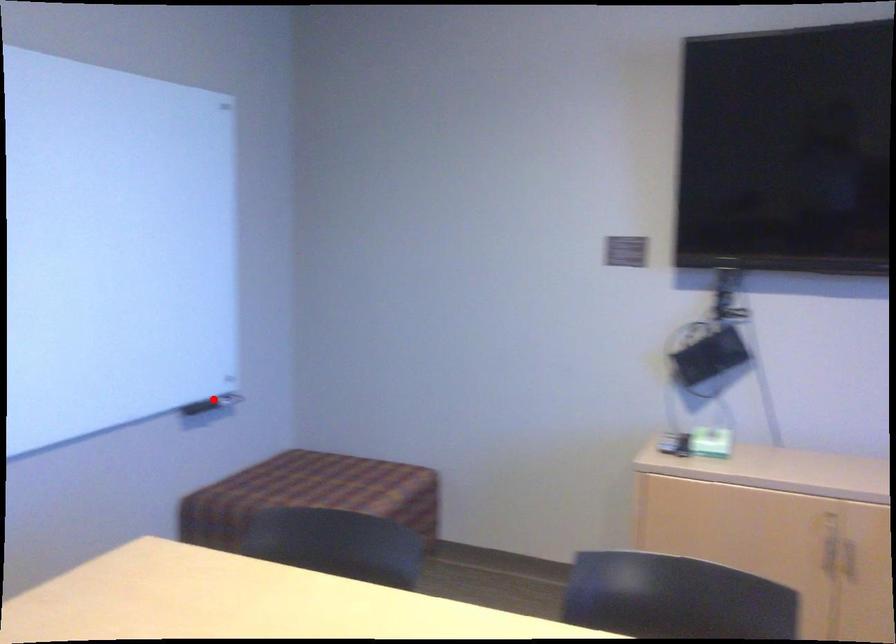
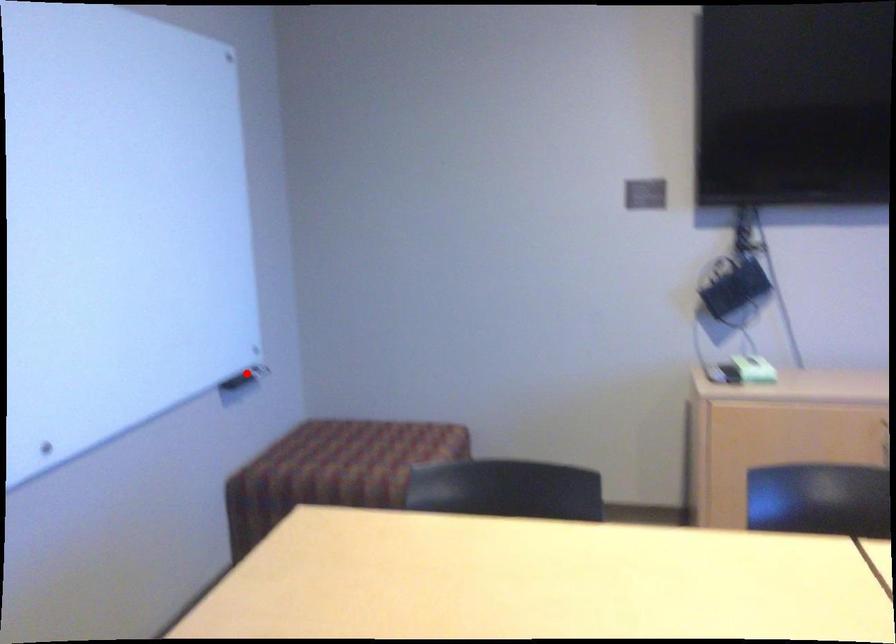
I am providing you with two images of the same scene from different viewpoints. A red point is marked on the first image and another point is marked on the second image. Are the points marked in image1 and image2 representing the same 3D position?

Yes